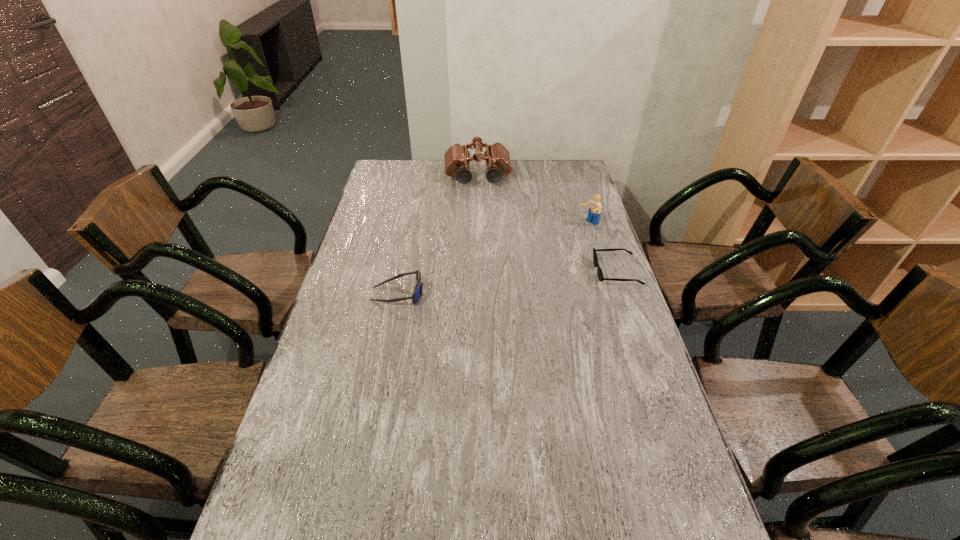
At what (x,y) coordinates should I click in order to perform the action: click on the taller sunglasses. Please return your answer as a coordinate pair (x, y). Image resolution: width=960 pixels, height=540 pixels. Looking at the image, I should click on (416, 295).

What are the coordinates of `the leftmost object` in the screenshot? It's located at (416, 295).

The width and height of the screenshot is (960, 540). Identify the location of the shortest object. (599, 271).

The image size is (960, 540). I want to click on the shorter sunglasses, so click(599, 271).

You are a GUI agent. You are given a task and a screenshot of the screen. Output one action in this format:
    pyautogui.click(x=<x>, y=<y>)
    Task: Click on the second object from left to right
    The image size is (960, 540).
    Given the screenshot: What is the action you would take?
    pyautogui.click(x=457, y=158)

You are a GUI agent. You are given a task and a screenshot of the screen. Output one action in this format:
    pyautogui.click(x=<x>, y=<y>)
    Task: Click on the farthest object
    The width and height of the screenshot is (960, 540).
    Given the screenshot: What is the action you would take?
    pyautogui.click(x=457, y=158)

Where is `the third nearest object`? This screenshot has width=960, height=540. the third nearest object is located at coordinates (594, 212).

What are the coordinates of `Lego` in the screenshot? It's located at (594, 212).

This screenshot has height=540, width=960. What are the coordinates of `vacant space situated on the front-facing side of the third tallest object` in the screenshot? It's located at [x=471, y=294].

The image size is (960, 540). In order to click on vacant area situated 0.290m on the front-facing side of the shortest object in this screenshot , I will do `click(510, 272)`.